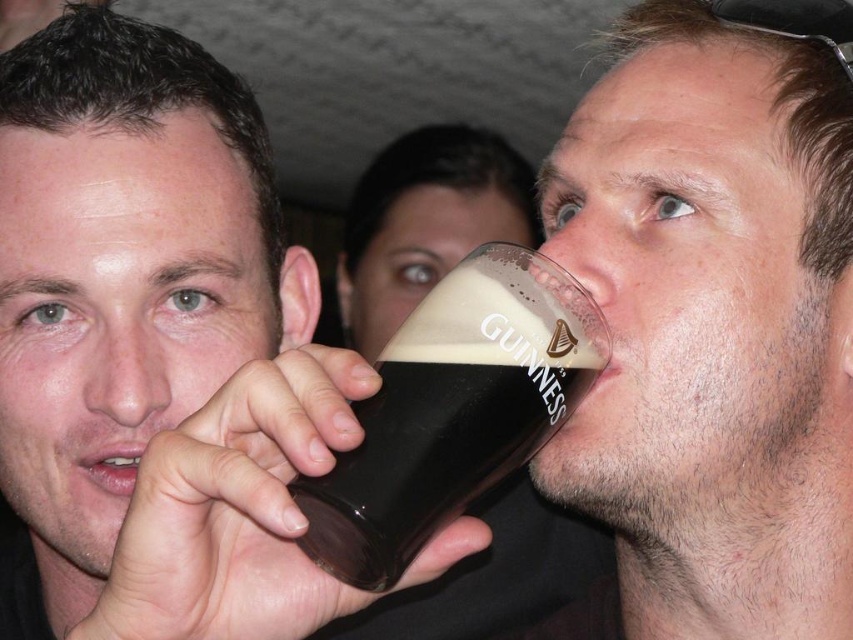
Question: In this image, where is dark glass at upper right located relative to dark glass at center?

Choices:
 (A) below
 (B) above

Answer: (B)

Question: Considering the relative positions of dark glass at upper right and dark glass/matte guinness pint at center in the image provided, where is dark glass at upper right located with respect to dark glass/matte guinness pint at center?

Choices:
 (A) above
 (B) below

Answer: (A)

Question: Among these points, which one is farthest from the camera?

Choices:
 (A) (492, 296)
 (B) (260, 172)

Answer: (B)

Question: Which point is farther to the camera?

Choices:
 (A) (173, 538)
 (B) (828, 340)

Answer: (B)

Question: Can you confirm if dark glass at center is thinner than dark glass/matte guinness pint at center?

Choices:
 (A) yes
 (B) no

Answer: (B)

Question: Which point is closer to the camera?

Choices:
 (A) dark glass/matte guinness pint at center
 (B) dark glass at upper right

Answer: (A)